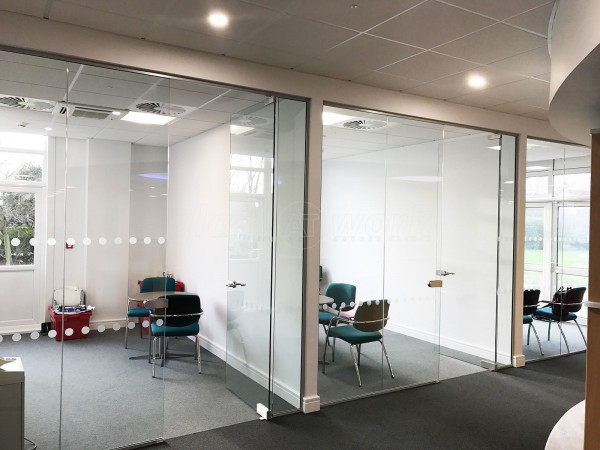
At what (x,y) coordinates should I click in order to perform the action: click on room divider / interior wall. Please return your answer as a coordinate pair (x, y). The width and height of the screenshot is (600, 450). Looking at the image, I should click on (308, 368), (517, 300).